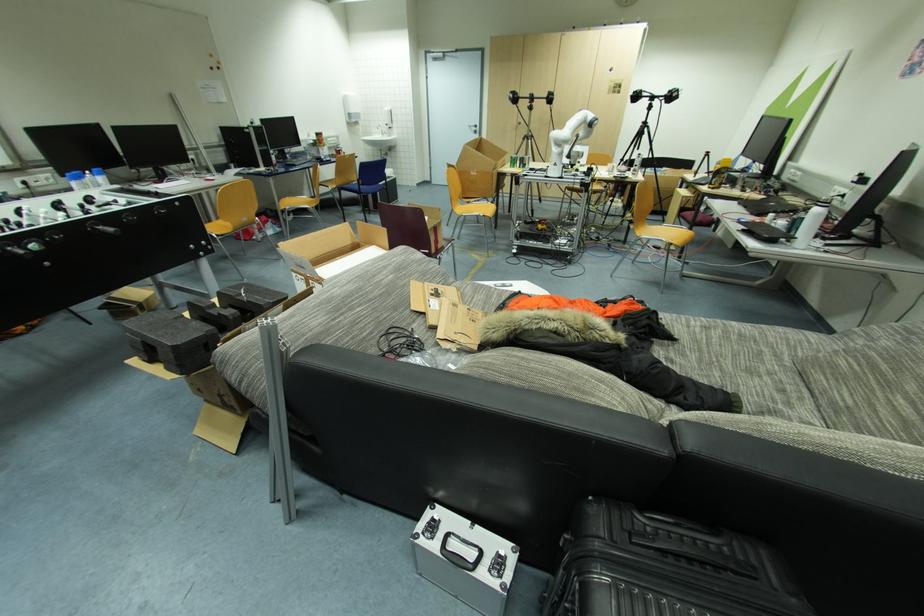
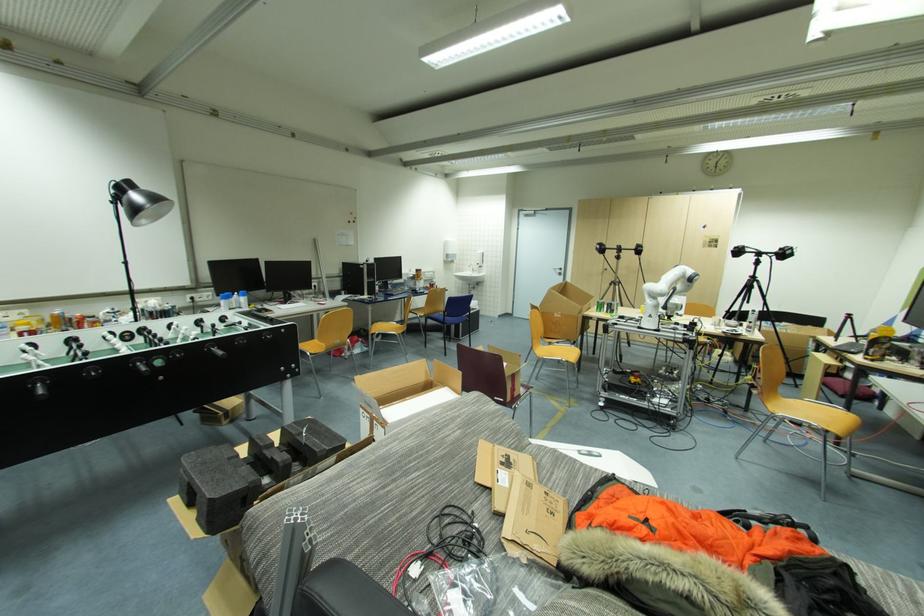
Where in the second image is the point corresponding to (x=283, y=201) from the first image?

(377, 323)